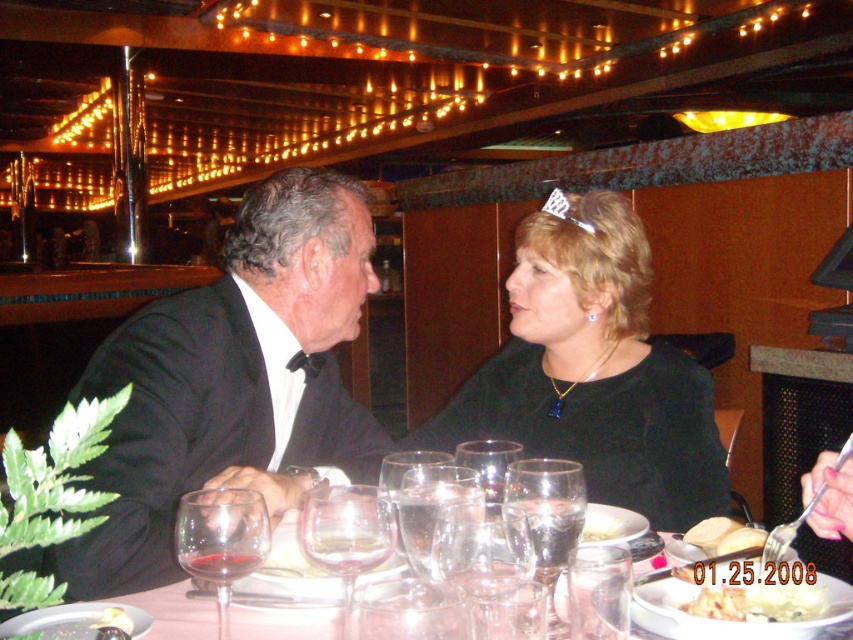
Who is more distant from viewer, (442, 481) or (241, 572)?

The point (442, 481) is behind.

Image resolution: width=853 pixels, height=640 pixels. Find the location of `transparent glass at table center`. transparent glass at table center is located at coordinates (427, 516).

Looking at this image, measure the distance between clear glassware at center and camera.

clear glassware at center and camera are 34.87 inches apart.

Does clear glassware at center appear under silver metallic tiara at upper center?

Yes, clear glassware at center is below silver metallic tiara at upper center.

Between point (271, 620) and point (560, 204), which one is positioned behind?

The point (560, 204) is more distant.

Locate an element on the screen. clear glassware at center is located at coordinates (173, 612).

Describe the element at coordinates (345, 534) in the screenshot. The height and width of the screenshot is (640, 853). I see `clear glass wine glass at table center` at that location.

Is clear glass wine glass at table center smaller than white bread at lower right?

Incorrect, clear glass wine glass at table center is not smaller in size than white bread at lower right.

This screenshot has height=640, width=853. Describe the element at coordinates (345, 534) in the screenshot. I see `clear glass wine glass at table center` at that location.

At what (x,y) coordinates should I click in order to perform the action: click on clear glass wine glass at table center. Please return your answer as a coordinate pair (x, y). This screenshot has width=853, height=640. Looking at the image, I should click on (345, 534).